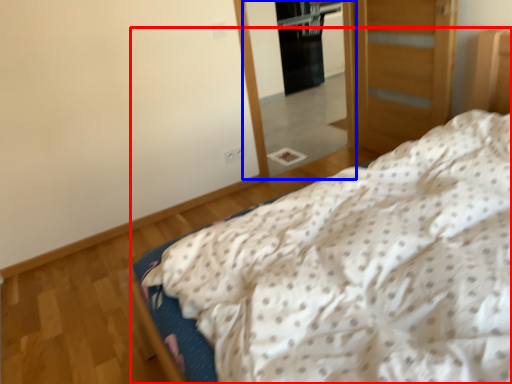
Question: Among these objects, which one is nearest to the camera, bed (highlighted by a red box) or mirror (highlighted by a blue box)?

Choices:
 (A) bed
 (B) mirror

Answer: (A)